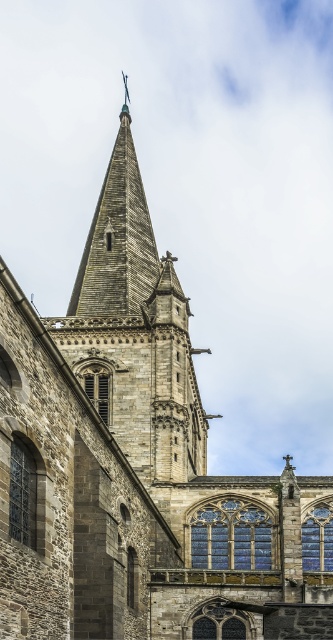
Who is more distant from viewer, (91, 317) or (85, 273)?

Positioned behind is point (85, 273).

Find the location of a particular element. gray stone spire at center is located at coordinates (134, 330).